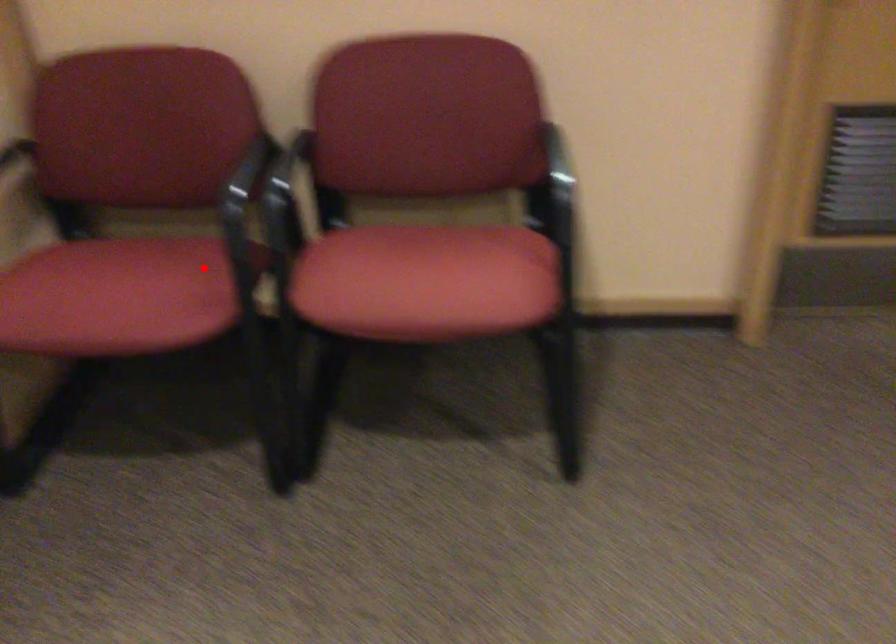
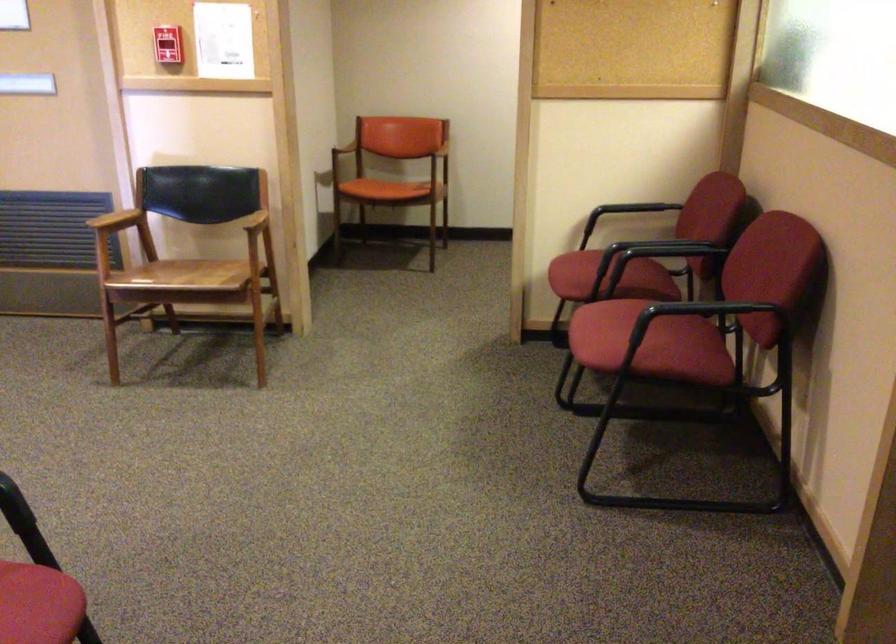
Question: I am providing you with two images of the same scene from different viewpoints. Given a red point in image1, look at the same physical point in image2. Is it:

Choices:
 (A) Closer to the viewpoint
 (B) Farther from the viewpoint

Answer: (B)